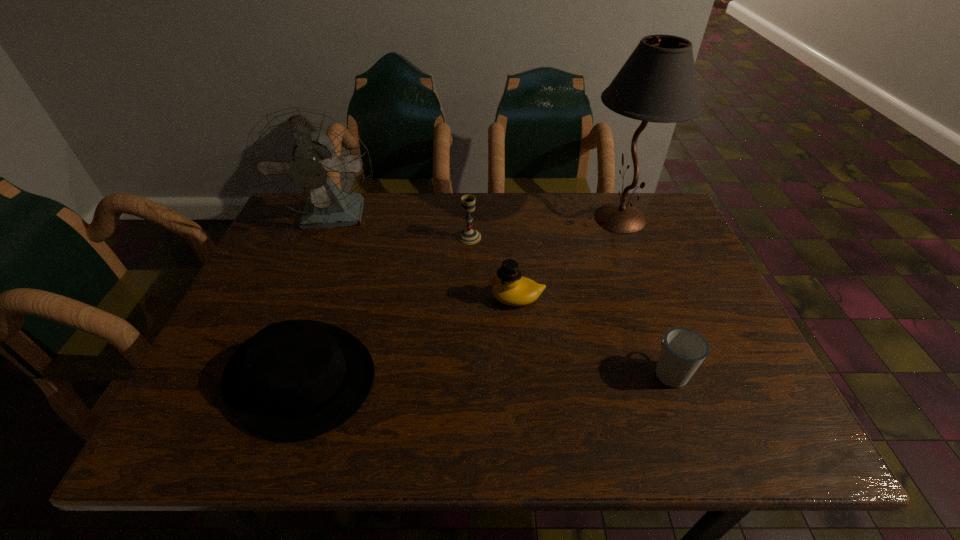
Find the location of a particular element. The height and width of the screenshot is (540, 960). free space between the fourth farthest object and the chalice is located at coordinates (492, 267).

Find the location of a particular element. The height and width of the screenshot is (540, 960). free point between the fedora and the tallest object is located at coordinates (461, 298).

Where is `vacant space in between the tallest object and the fedora`? This screenshot has height=540, width=960. vacant space in between the tallest object and the fedora is located at coordinates (461, 298).

Find the location of a particular element. vacant space that is in between the fedora and the third object from right to left is located at coordinates (409, 338).

Locate an element on the screen. The width and height of the screenshot is (960, 540). free space between the fan and the duck is located at coordinates (426, 258).

Where is `vacant area that lies between the fedora and the fourth farthest object`? The height and width of the screenshot is (540, 960). vacant area that lies between the fedora and the fourth farthest object is located at coordinates (409, 338).

Where is `object identified as the fourth closest to the fourth farthest object`? object identified as the fourth closest to the fourth farthest object is located at coordinates (295, 379).

This screenshot has width=960, height=540. Find the location of `object that is the fifth nearest to the chalice`. object that is the fifth nearest to the chalice is located at coordinates coord(683,350).

Find the location of a particular element. vacant space that satisfies the following two spatial constraints: 1. in front of the third object from left to right to blow air; 2. on the left side of the fan is located at coordinates (328, 237).

The image size is (960, 540). I want to click on free region that satisfies the following two spatial constraints: 1. in front of the fan to blow air; 2. on the left side of the third object from left to right, so click(x=328, y=237).